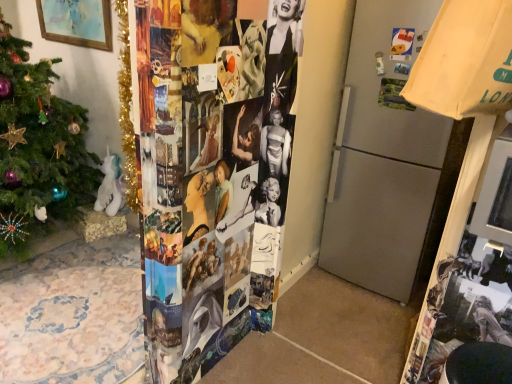
Question: From the image's perspective, is gold tinsel christmas tree at left above or below wooden framed painting at upper left?

Choices:
 (A) below
 (B) above

Answer: (A)

Question: Considering the positions of gold tinsel christmas tree at left and wooden framed painting at upper left in the image, is gold tinsel christmas tree at left taller or shorter than wooden framed painting at upper left?

Choices:
 (A) tall
 (B) short

Answer: (A)

Question: Is gold tinsel christmas tree at left bigger or smaller than wooden framed painting at upper left?

Choices:
 (A) big
 (B) small

Answer: (B)

Question: From the image's perspective, is wooden framed painting at upper left located above or below gold tinsel christmas tree at left?

Choices:
 (A) below
 (B) above

Answer: (B)

Question: In terms of height, does wooden framed painting at upper left look taller or shorter compared to gold tinsel christmas tree at left?

Choices:
 (A) tall
 (B) short

Answer: (B)

Question: In terms of width, does wooden framed painting at upper left look wider or thinner when compared to gold tinsel christmas tree at left?

Choices:
 (A) thin
 (B) wide

Answer: (A)

Question: Is point (87, 21) positioned closer to the camera than point (126, 180)?

Choices:
 (A) closer
 (B) farther

Answer: (B)